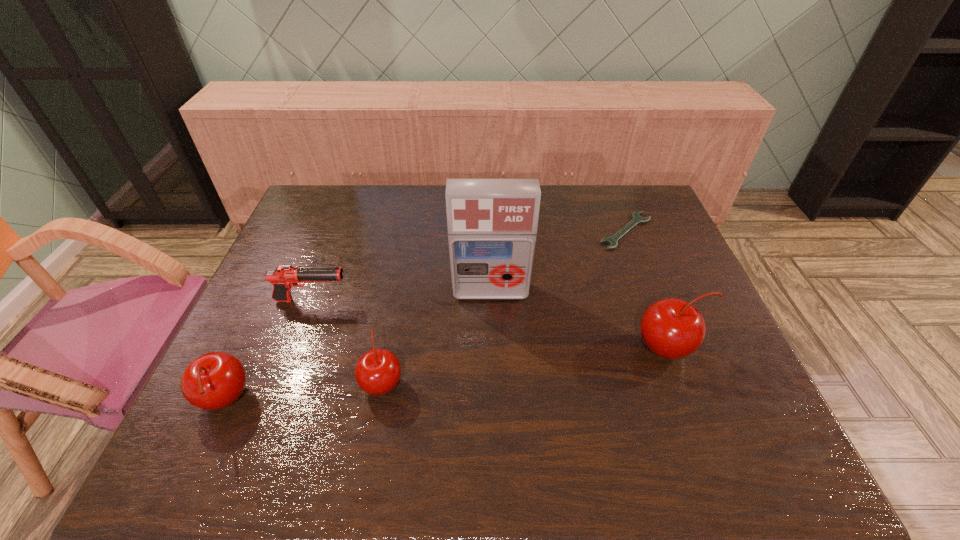
Please point a location where one more cherry can be added evenly. Please provide its 2D coordinates. Your answer should be formatted as a tuple, i.e. [(x, y)], where the tuple contains the x and y coordinates of a point satisfying the conditions above.

[(530, 364)]